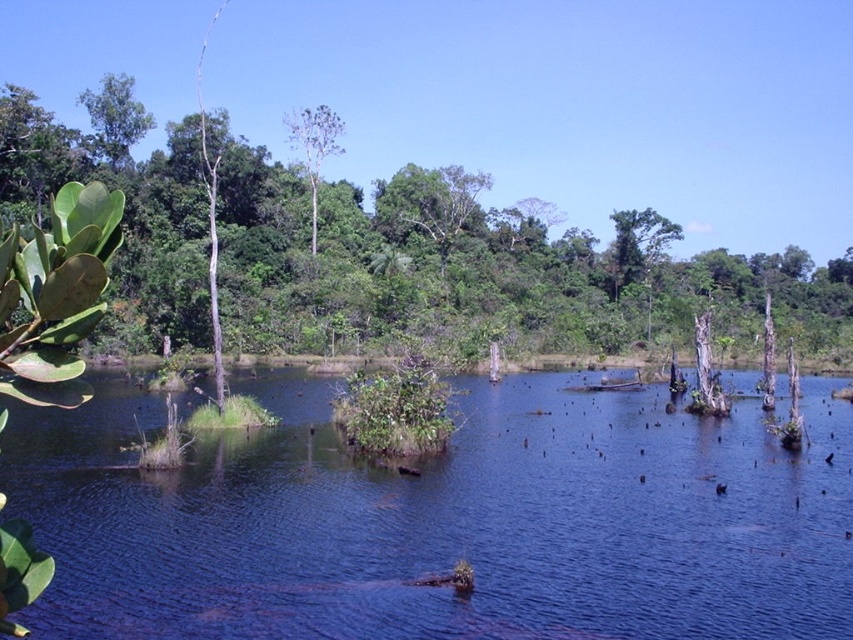
Does blue water at center have a lesser width compared to green leafy tree at upper center?

No.

Is blue water at center wider than green leafy tree at upper center?

Indeed, blue water at center has a greater width compared to green leafy tree at upper center.

Does point (456, 612) come closer to viewer compared to point (624, 285)?

Yes, it is in front of point (624, 285).

Locate an element on the screen. blue water at center is located at coordinates (442, 522).

Which is behind, point (637, 211) or point (315, 120)?

Positioned behind is point (637, 211).

Can you confirm if green leafy tree at upper center is bigger than green leafy tree at center?

Actually, green leafy tree at upper center might be smaller than green leafy tree at center.

Is point (682, 234) positioned behind point (310, 152)?

No, (682, 234) is closer to viewer.

The image size is (853, 640). In order to click on green leafy tree at upper center in this screenshot , I will do `click(637, 244)`.

Looking at this image, between green leafy tree at left and green leafy tree at upper center, which one is positioned higher?

green leafy tree at left is above.

Locate an element on the screen. green leafy tree at left is located at coordinates (469, 266).

Where is `green leafy tree at left`? The width and height of the screenshot is (853, 640). green leafy tree at left is located at coordinates (469, 266).